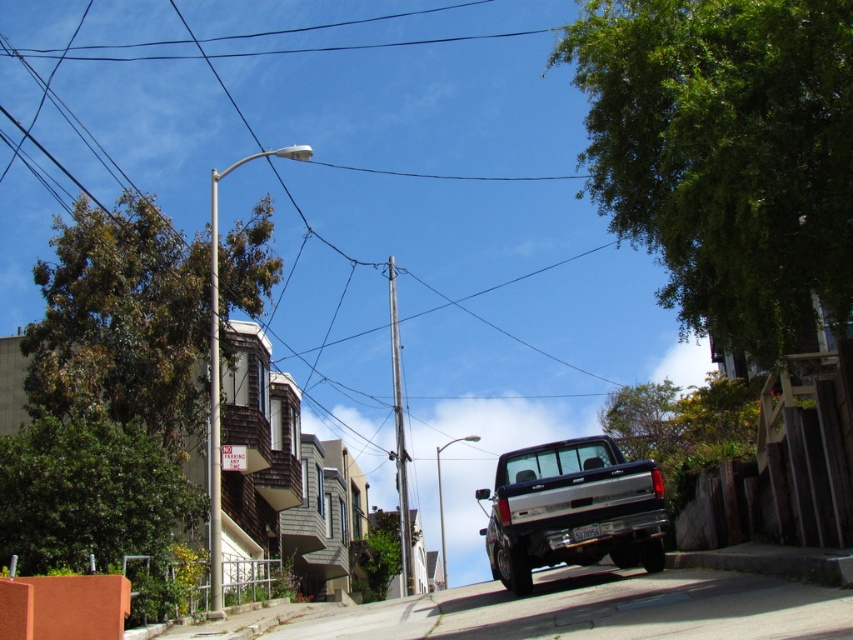
You are standing at the corner of the street and want to find the green leafy tree at upper right. According to the coordinates provided, where exactly is it positioned?

The green leafy tree at upper right is located at point (x=724, y=154), so it is positioned at the upper right corner of the image based on the coordinate system provided.

You are standing at the point with coordinates (572,509) in the street scene. What object is exactly at your current location?

The shiny silver truck at center is located at point (572,509).

You are a delivery driver trying to park your shiny silver truck at center between two poles. The nearest pole is the metallic silver pole at upper center. Can you park your truck there without hitting the pole?

The shiny silver truck at center is located below the metallic silver pole at upper center, so there is enough vertical space to park the truck without hitting the pole.